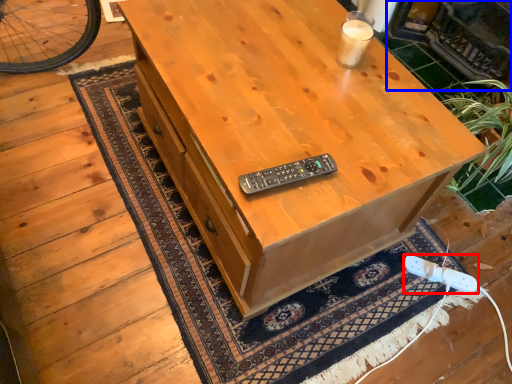
Question: Which object is closer to the camera taking this photo, game controller (highlighted by a red box) or fireplace (highlighted by a blue box)?

Choices:
 (A) game controller
 (B) fireplace

Answer: (A)